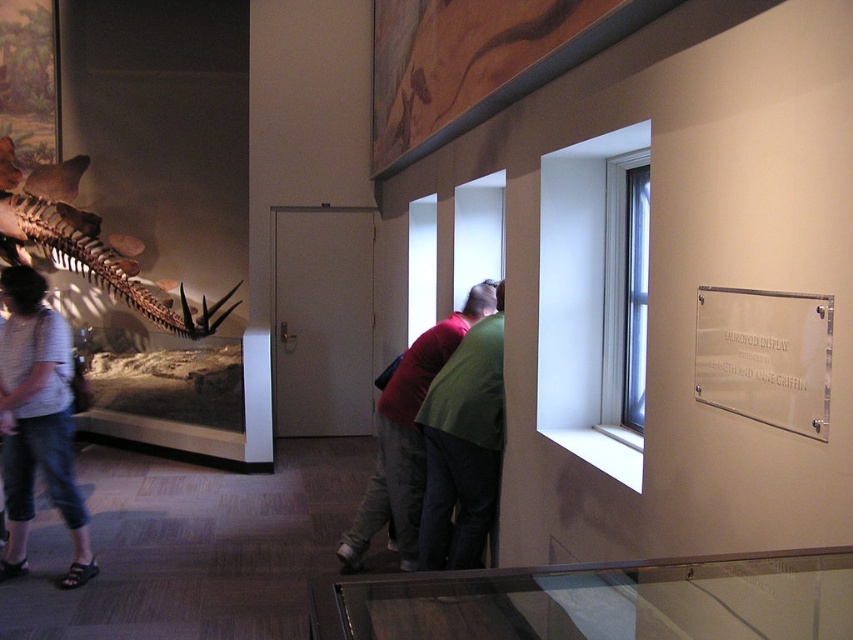
You are standing in the museum and want to take a photo of both the glass display case and the large dinosaur skeleton. You notice two points marked in the scene. One is at point coordinates point at (15, 259) and the other is at point coordinates point at (416, 456). Which point is closer to you, the viewer, so you can position yourself optimally for the photo?

Point at (15, 259) is closer to the viewer than point at (416, 456). Position yourself near this point to ensure both the glass display case and the large dinosaur skeleton are in frame.

You are a visitor in the museum and you see the denim shorts at lower left and the matte brown skeleton at left. Which object is positioned more to the right side of the scene?

The denim shorts at lower left are positioned to the right of the matte brown skeleton at left, so they are more to the right side of the scene.